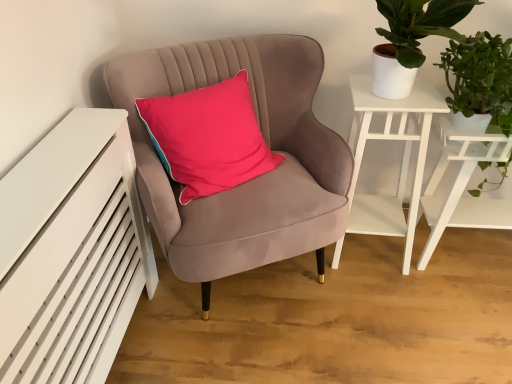
I want to click on vacant space in front of white matte table at right, so click(x=466, y=318).